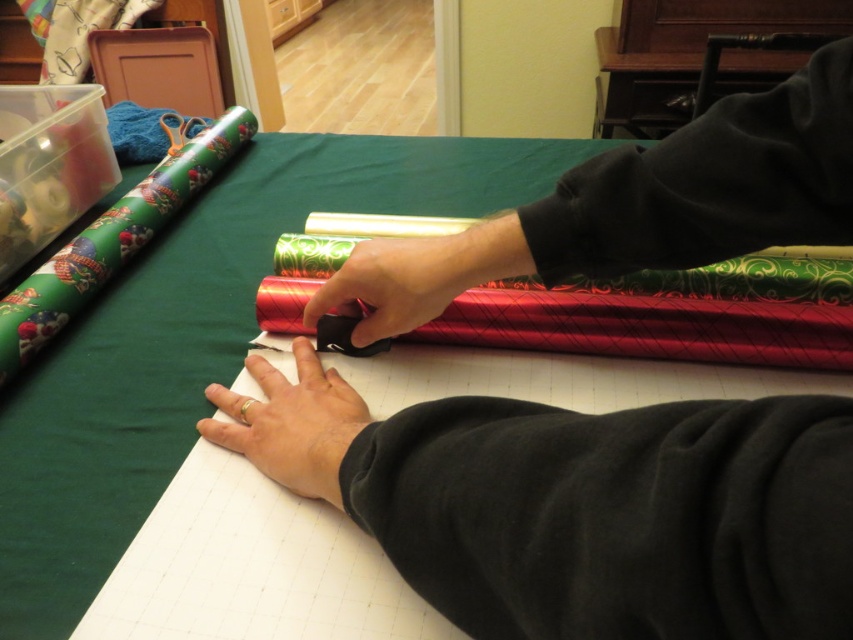
You are helping someone wrap a gift and notice two fabrics on the table. The black fleece at lower right and the green fabric at upper right. Which fabric should you choose if you need a larger piece to cover a large box?

The black fleece at lower right has a larger size compared to the green fabric at upper right, so you should choose the black fleece at lower right to cover the large box.

You are a guest observing someone wrapping gifts. You notice the gold ring at lower center and the black matte scissors at center. Which object appears larger in the image?

The gold ring at lower center is taller than the black matte scissors at center, so it appears larger in the image.

You are organizing a gift wrapping station. You have two fabric pieces on the table. Which fabric is positioned to the left of the other? The black fleece at lower right and the green fabric at upper right.

The black fleece at lower right is to the left of the green fabric at upper right.